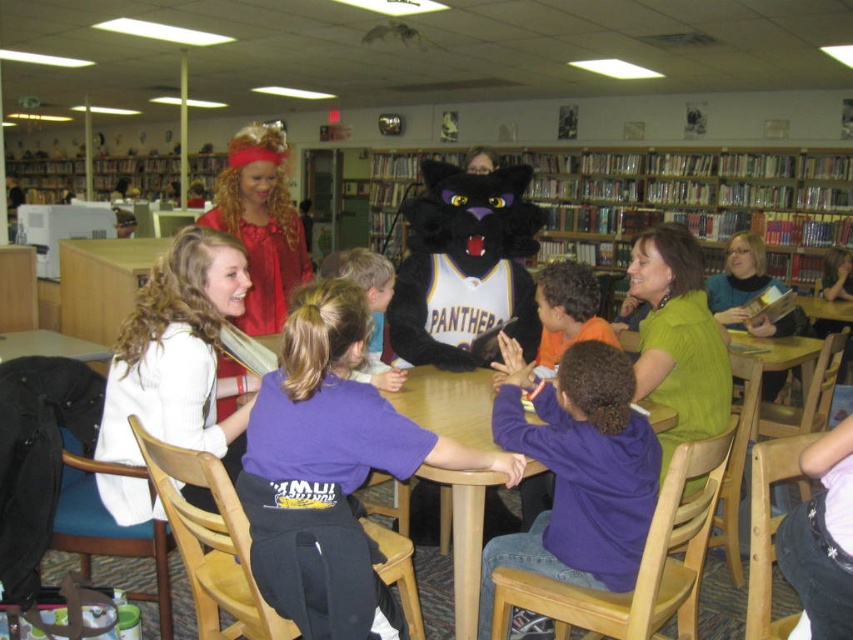
Question: Which object is positioned farthest from the white sweater at center?

Choices:
 (A) wooden at center
 (B) purple cotton shirt at center

Answer: (A)

Question: Which point is farther to the camera?

Choices:
 (A) (505, 310)
 (B) (331, 609)
 (C) (759, 163)
 (D) (236, 410)

Answer: (C)

Question: Which of the following is the closest to the observer?

Choices:
 (A) (412, 470)
 (B) (477, 412)

Answer: (A)

Question: Does wooden bookshelf at center have a lesser width compared to wooden at center?

Choices:
 (A) no
 (B) yes

Answer: (A)

Question: Does fuzzy black panther at center have a larger size compared to wooden at center?

Choices:
 (A) yes
 (B) no

Answer: (B)

Question: Is fuzzy black panther at center bigger than wooden at center?

Choices:
 (A) no
 (B) yes

Answer: (A)